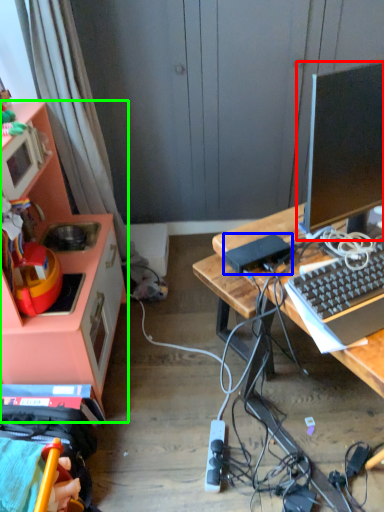
Question: Considering the real-world distances, which object is farthest from television (highlighted by a red box)? appliance (highlighted by a blue box) or cabinetry (highlighted by a green box)?

Choices:
 (A) appliance
 (B) cabinetry

Answer: (B)